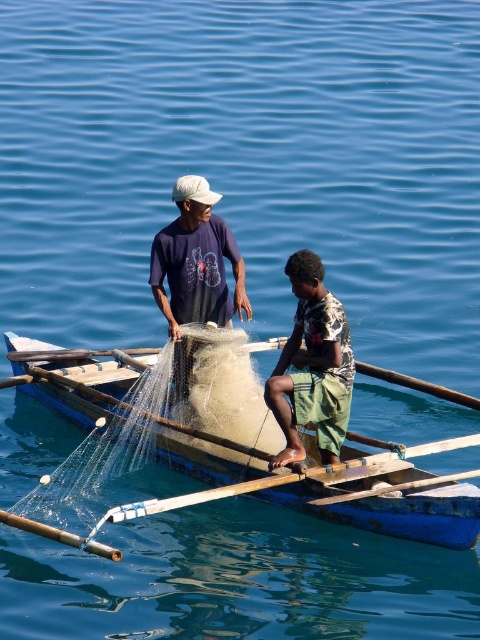
Does printed fabric shirt at center have a smaller size compared to wooden smooth paddle at center?

Incorrect, printed fabric shirt at center is not smaller in size than wooden smooth paddle at center.

From the picture: Is the position of printed fabric shirt at center less distant than that of wooden smooth paddle at center?

No, printed fabric shirt at center is further to the viewer.

Is point (282, 429) closer to camera compared to point (327, 497)?

No, it is not.

I want to click on printed fabric shirt at center, so click(x=312, y=365).

Which is above, wooden boat at center or matte blue shirt at center?

matte blue shirt at center

Is point (139, 444) positioned in front of point (184, 284)?

Yes, it is in front of point (184, 284).

The height and width of the screenshot is (640, 480). I want to click on wooden boat at center, so click(x=167, y=401).

What are the coordinates of `wooden boat at center` in the screenshot? It's located at (x=167, y=401).

Does point (414, 515) lie in front of point (312, 499)?

Yes.

Is wooden boat at center above wooden smooth paddle at center?

Correct, wooden boat at center is located above wooden smooth paddle at center.

Does point (263, 449) lie behind point (436, 477)?

Yes.

I want to click on wooden boat at center, so click(x=167, y=401).